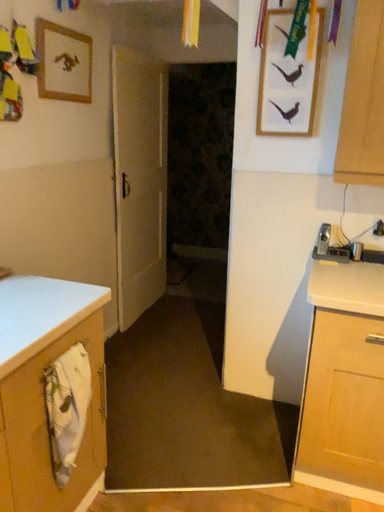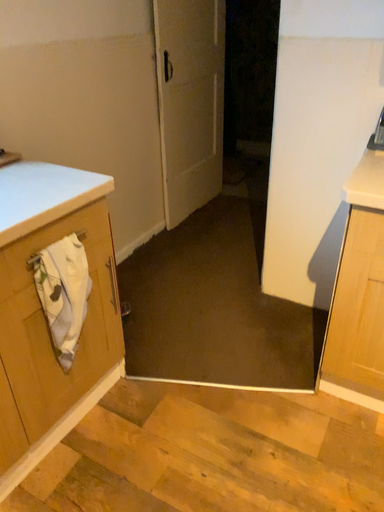
Question: How did the camera likely rotate when shooting the video?

Choices:
 (A) rotated upward
 (B) rotated downward

Answer: (B)